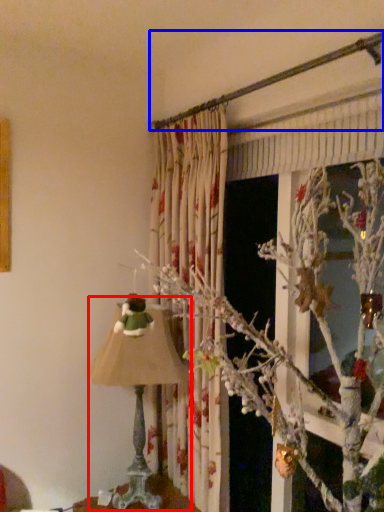
Question: Which point is further to the camera, lamp (highlighted by a red box) or branch (highlighted by a blue box)?

Choices:
 (A) lamp
 (B) branch

Answer: (A)